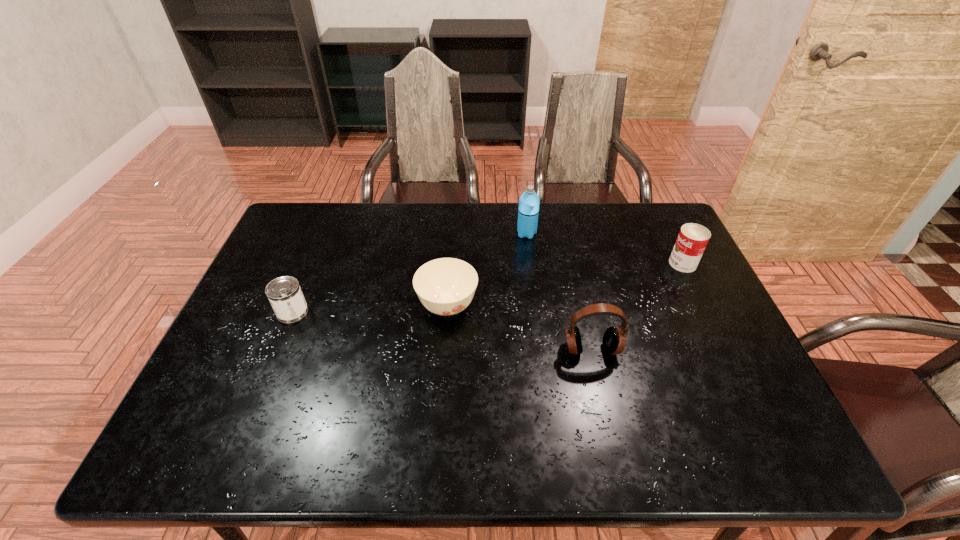
In order to click on vacant space at the near edge of the desktop in this screenshot , I will do pos(512,460).

Identify the location of free spot at the left edge of the desktop. (252, 379).

I want to click on vacant space at the right edge of the desktop, so click(698, 294).

In the image, there is a desktop. Where is `vacant space at the far left corner`? vacant space at the far left corner is located at coordinates (290, 220).

The image size is (960, 540). What are the coordinates of `vacant region at the far right corner of the desktop` in the screenshot? It's located at (660, 233).

The height and width of the screenshot is (540, 960). In order to click on free space between the fourth object from right to left and the left can in this screenshot , I will do `click(370, 309)`.

Locate an element on the screen. vacant region between the farther can and the sugar bowl is located at coordinates (565, 285).

Find the location of a particular element. This screenshot has width=960, height=540. free space that is in between the thermos bottle and the second object from left to right is located at coordinates (487, 270).

The width and height of the screenshot is (960, 540). Identify the location of free area in between the sugar bowl and the fourth nearest object. coord(565,285).

Find the location of a particular element. free space between the sugar bowl and the farthest object is located at coordinates (487, 270).